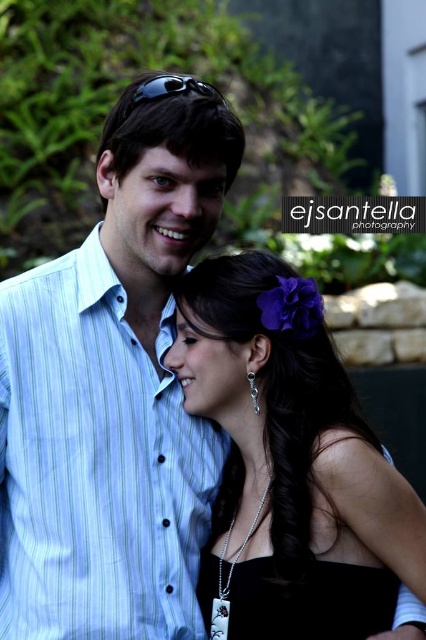
How far apart are blue striped shirt at upper left and black plastic sunglasses at upper center?

A distance of 37.34 inches exists between blue striped shirt at upper left and black plastic sunglasses at upper center.

Is point (117, 573) behind point (131, 99)?

No, it is in front of (131, 99).

Image resolution: width=426 pixels, height=640 pixels. What do you see at coordinates (94, 465) in the screenshot? I see `blue striped shirt at upper left` at bounding box center [94, 465].

This screenshot has width=426, height=640. Find the location of `blue striped shirt at upper left`. blue striped shirt at upper left is located at coordinates (94, 465).

Consider the image. Which is more to the left, blue striped shirt at upper left or black satin dress at center?

blue striped shirt at upper left is more to the left.

Between point (158, 476) and point (207, 289), which one is positioned behind?

Positioned behind is point (207, 289).

This screenshot has width=426, height=640. I want to click on blue striped shirt at upper left, so tap(94, 465).

Does point (307, 387) come in front of point (157, 99)?

No, it is not.

Is black satin dress at center below black plastic sunglasses at upper center?

Correct, black satin dress at center is located below black plastic sunglasses at upper center.

Describe the element at coordinates (290, 464) in the screenshot. The height and width of the screenshot is (640, 426). I see `black satin dress at center` at that location.

Image resolution: width=426 pixels, height=640 pixels. I want to click on black satin dress at center, so click(290, 464).